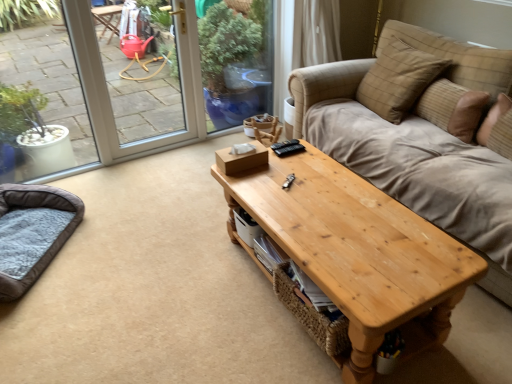
This screenshot has width=512, height=384. What are the coordinates of `free space above natural wood coffee table at center (from a real-world perspective)` in the screenshot? It's located at (338, 210).